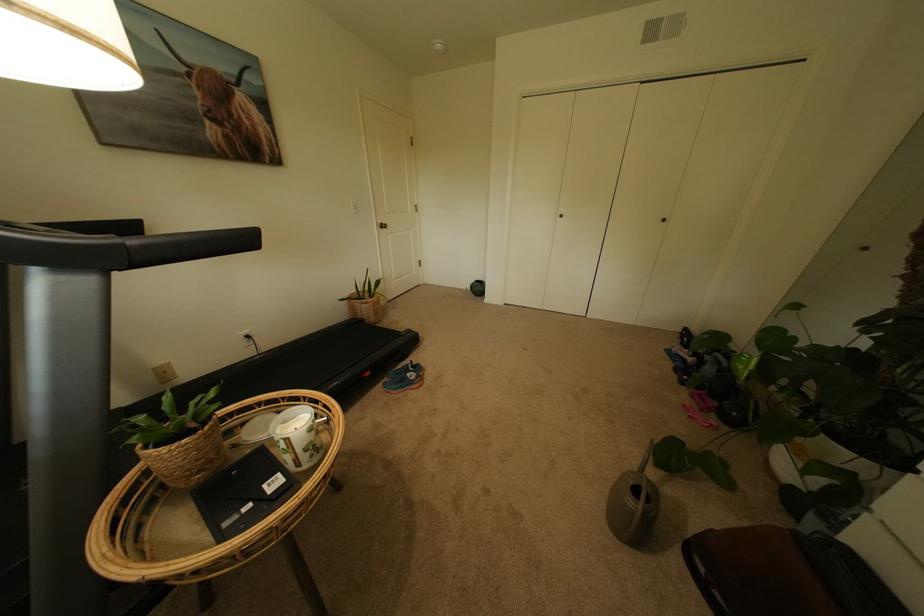
Image resolution: width=924 pixels, height=616 pixels. What are the coordinates of `silver door knob` in the screenshot? It's located at (386, 225).